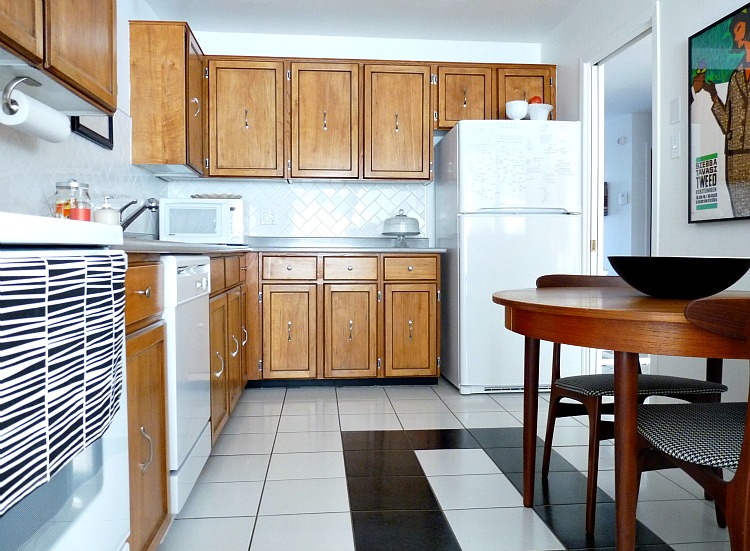
Locate an element on the screen. The height and width of the screenshot is (551, 750). microwave is located at coordinates (193, 221).